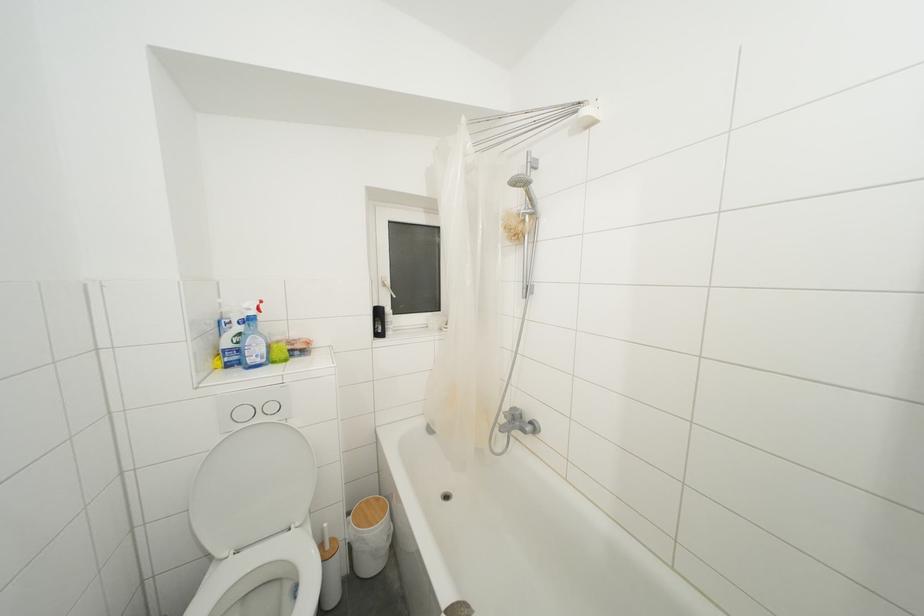
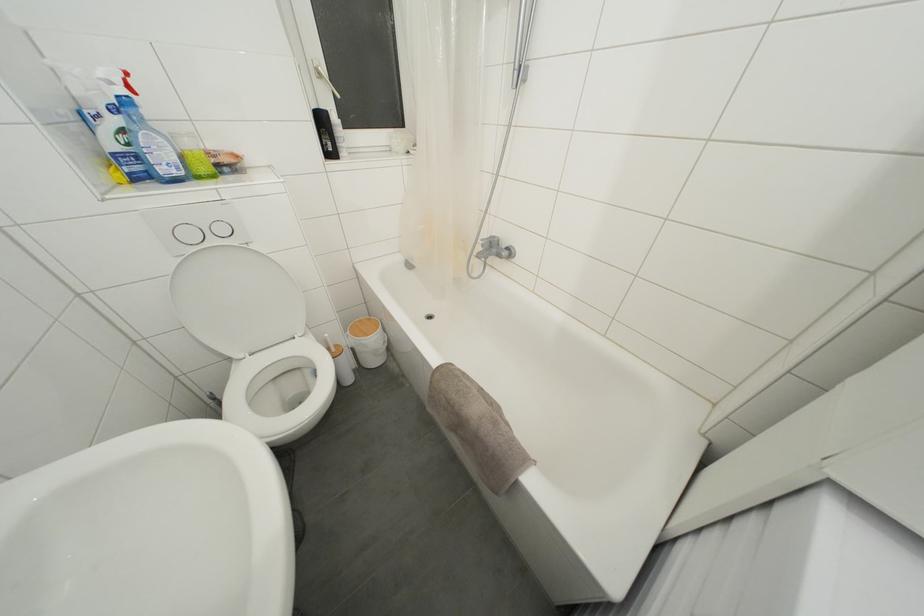
Locate, in the second image, the point that corresponds to (383,318) in the first image.

(325, 126)